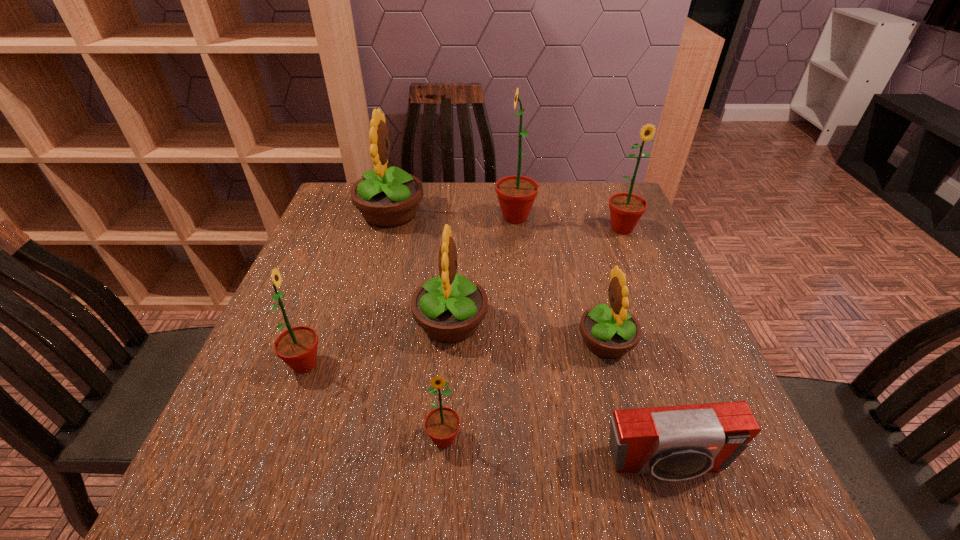
Identify the location of vacant region at the far edge of the desktop. Image resolution: width=960 pixels, height=540 pixels. (444, 200).

At what (x,y) coordinates should I click in order to perform the action: click on free point at the near edge. Please return your answer as a coordinate pair (x, y). This screenshot has height=540, width=960. Looking at the image, I should click on (580, 469).

What are the coordinates of `vacant area at the left edge` in the screenshot? It's located at (338, 287).

The height and width of the screenshot is (540, 960). Identify the location of vacant space at the right edge of the desktop. (640, 342).

The image size is (960, 540). I want to click on free space at the near right corner of the desktop, so click(735, 503).

Identify the location of free space between the rightmost yellow sunflower and the second yellow sunflower from right to left. This screenshot has width=960, height=540. (528, 332).

Find the location of `unoccupied position between the third sunflower from right to left and the leftmost yellow sunflower`. unoccupied position between the third sunflower from right to left and the leftmost yellow sunflower is located at coordinates (453, 215).

Where is `free point between the biggest yellow sunflower and the nearest green sunflower`? The image size is (960, 540). free point between the biggest yellow sunflower and the nearest green sunflower is located at coordinates (418, 326).

Find the location of a particular element. The width and height of the screenshot is (960, 540). free space between the leftmost green sunflower and the smallest yellow sunflower is located at coordinates (455, 353).

Find the location of a particular element. free area in between the nearest sunflower and the sixth sunflower from left to right is located at coordinates (525, 390).